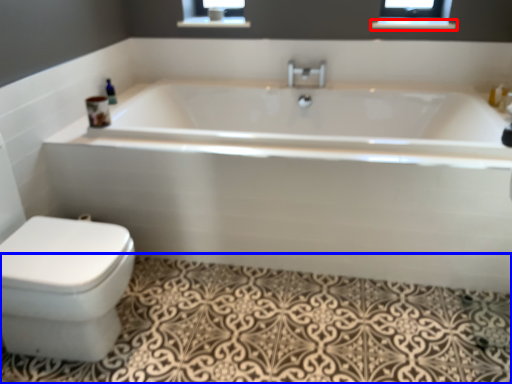
Question: Which point is further to the camera, balustrade (highlighted by a red box) or bath mat (highlighted by a blue box)?

Choices:
 (A) balustrade
 (B) bath mat

Answer: (A)